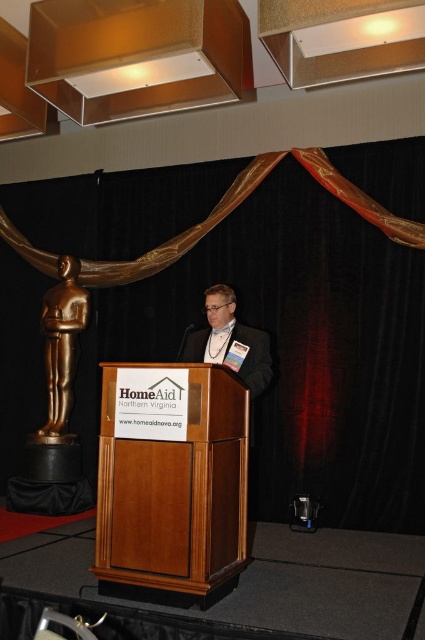
You are standing at the entrance of the event hall and see the wooden podium at center. If you walk straight ahead, will you reach the podium directly without needing to turn?

The wooden podium at center is located at point [175,497], so if you walk straight ahead from the entrance, you will reach the podium directly without needing to turn.

You are an event photographer at the charity event. You need to capture a photo of both the wooden podium at center and the matte black suit at center. Based on their positions, which object should you focus on first to ensure both are in frame?

The wooden podium at center is located below the matte black suit at center, so you should focus on the matte black suit at center first to ensure both are in frame.

You are a photographer standing at the back of the room. You need to capture a photo that includes both the matte gold fabric at upper center and the wooden podium at center. Given that your camera has a maximum focus range of 2 meters, will you be able to include both objects in the same frame without moving closer?

The distance between the matte gold fabric at upper center and the wooden podium at center is 1.95 meters, which is within the camera maximum focus range of 2 meters. Therefore, you can include both objects in the same frame without moving closer.